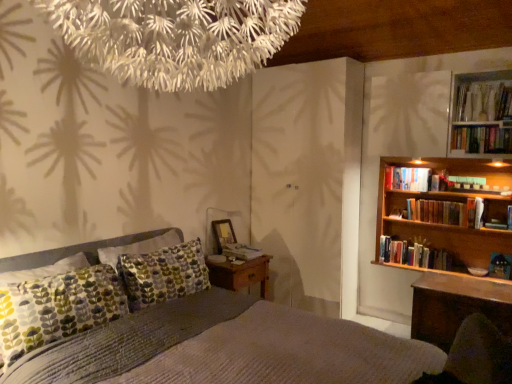
Question: Does hardcover books at upper right, the first book when ordered from right to left, have a greater height compared to hardcover books at upper right, which is counted as the 2th book, starting from the right?

Choices:
 (A) no
 (B) yes

Answer: (B)

Question: Is hardcover books at upper right, marked as the 6th book in a left-to-right arrangement, behind hardcover books at upper right, the 5th book when ordered from bottom to top?

Choices:
 (A) yes
 (B) no

Answer: (A)

Question: Is hardcover books at upper right, the first book when ordered from right to left, beside hardcover books at upper right, arranged as the second book when viewed from the top?

Choices:
 (A) no
 (B) yes

Answer: (A)

Question: Does hardcover books at upper right, acting as the sixth book starting from the bottom, appear on the left side of hardcover books at upper right, the fifth book positioned from the left?

Choices:
 (A) no
 (B) yes

Answer: (A)

Question: Is hardcover books at upper right, marked as the 6th book in a left-to-right arrangement, shorter than hardcover books at upper right, the 5th book when ordered from bottom to top?

Choices:
 (A) yes
 (B) no

Answer: (B)

Question: In the image, is hardcover book at bedside, the 2th book when ordered from bottom to top, on the left side or the right side of hardcover book at upper right, the fifth book from the right?

Choices:
 (A) left
 (B) right

Answer: (A)

Question: Do you think hardcover book at bedside, which is the fifth book in top-to-bottom order, is within hardcover book at upper right, which ranks as the fourth book in bottom-to-top order, or outside of it?

Choices:
 (A) outside
 (B) inside

Answer: (A)

Question: From their relative heights in the image, would you say hardcover book at bedside, the 1th book viewed from the left, is taller or shorter than hardcover book at upper right, the third book from the top?

Choices:
 (A) short
 (B) tall

Answer: (A)

Question: In terms of size, does hardcover book at bedside, the 2th book when ordered from bottom to top, appear bigger or smaller than hardcover book at upper right, the fifth book from the right?

Choices:
 (A) big
 (B) small

Answer: (B)

Question: From a real-world perspective, relative to textured gray bed at center, is hardcover books at upper right, acting as the sixth book starting from the bottom, vertically above or below?

Choices:
 (A) below
 (B) above

Answer: (B)

Question: Is hardcover books at upper right, acting as the sixth book starting from the bottom, taller or shorter than textured gray bed at center?

Choices:
 (A) short
 (B) tall

Answer: (A)

Question: Do you think hardcover books at upper right, marked as the 6th book in a left-to-right arrangement, is within textured gray bed at center, or outside of it?

Choices:
 (A) inside
 (B) outside

Answer: (B)

Question: Is hardcover books at upper right, acting as the first book starting from the top, bigger or smaller than textured gray bed at center?

Choices:
 (A) big
 (B) small

Answer: (B)

Question: Is point (32, 258) closer or farther from the camera than point (379, 251)?

Choices:
 (A) closer
 (B) farther

Answer: (A)

Question: From their relative heights in the image, would you say textured gray bed at center is taller or shorter than wooden bookshelf at right, placed as the third book when sorted from left to right?

Choices:
 (A) tall
 (B) short

Answer: (A)